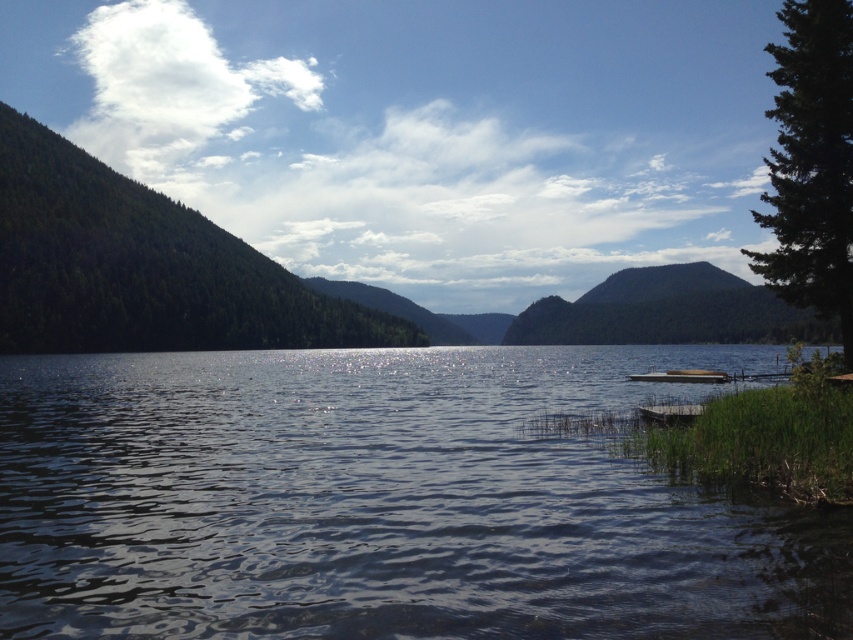
Question: Which point is closer to the camera?

Choices:
 (A) (84, 163)
 (B) (370, 451)
 (C) (827, 317)
 (D) (717, 380)

Answer: (B)

Question: Does glistening water at center appear on the right side of green textured pine tree at right?

Choices:
 (A) no
 (B) yes

Answer: (A)

Question: Can you confirm if glistening water at center is wider than green textured forest at left?

Choices:
 (A) yes
 (B) no

Answer: (B)

Question: Which object is closer to the camera taking this photo?

Choices:
 (A) wooden dock at lower right
 (B) green textured pine tree at right

Answer: (B)

Question: Is glistening water at center smaller than green textured pine tree at right?

Choices:
 (A) yes
 (B) no

Answer: (B)

Question: Which point is closer to the camera?

Choices:
 (A) (709, 381)
 (B) (13, 307)
 (C) (701, 564)
 (D) (813, 284)

Answer: (C)